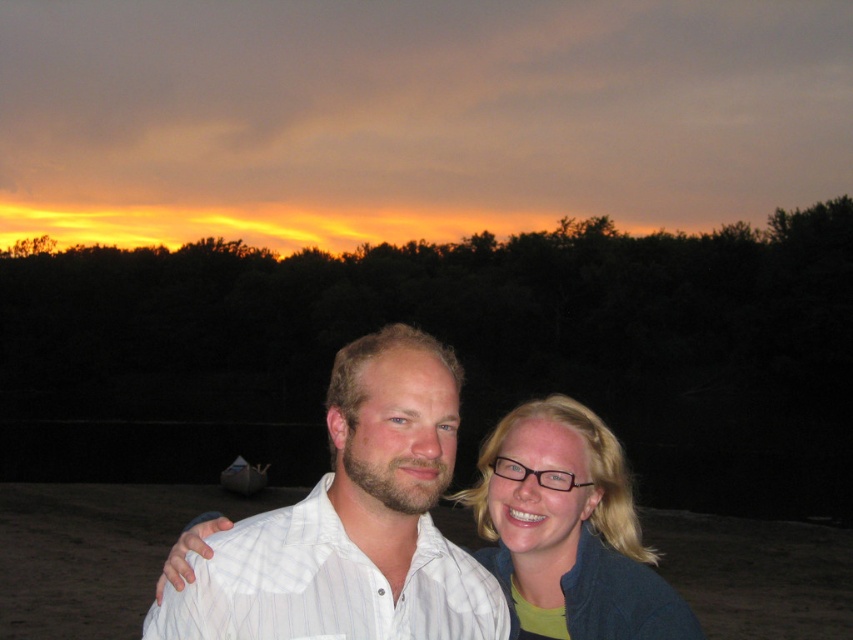
You are standing at the point labeled point (x=549, y=628) and want to walk towards the point labeled point (x=410, y=509). According to the scene description, will you be moving towards the foreground or background?

Moving towards point (x=410, y=509) from point (x=549, y=628) means you are moving towards the foreground because point (x=410, y=509) is in front of point (x=549, y=628).

You are a photographer trying to capture a portrait of the two people in the scene. Since you want to ensure both subjects are clearly visible, you need to adjust your camera angle. Considering the height difference between the white striped shirt at center and the blonde hair at center, which subject should you focus on first to ensure proper framing?

The white striped shirt at center is much taller than the blonde hair at center. To ensure proper framing, focus on the taller subject first, which is the white striped shirt at center, then adjust the angle to include the shorter subject, the blonde hair at center.

You are a photographer trying to capture the sunset. You notice two people in the frame with a white striped shirt at center and blonde hair at center. Which object is positioned to the left of the other?

The white striped shirt at center is to the left of blonde hair at center.